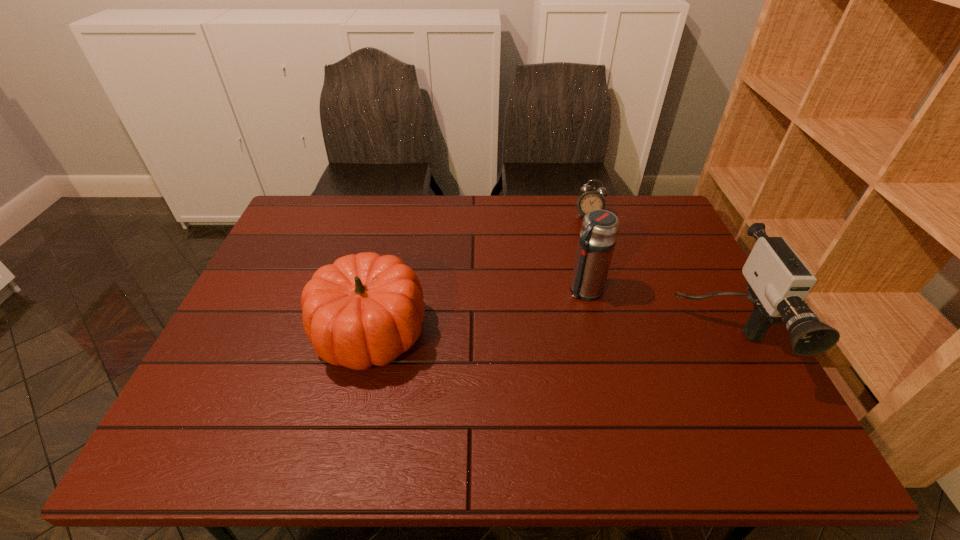
At what (x,y) coordinates should I click in order to perform the action: click on vacant space at the near edge of the desktop. Please return your answer as a coordinate pair (x, y). This screenshot has width=960, height=540. Looking at the image, I should click on (671, 403).

In the image, there is a desktop. Where is `free space at the left edge`? free space at the left edge is located at coordinates (227, 362).

The height and width of the screenshot is (540, 960). In the image, there is a desktop. In order to click on vacant space at the right edge in this screenshot , I will do `click(695, 283)`.

Locate an element on the screen. This screenshot has width=960, height=540. free space at the far left corner is located at coordinates (310, 235).

Identify the location of free space at the far right corner of the desktop. (655, 231).

Identify the location of unoccupied area between the alarm clock and the camcorder. (656, 276).

Identify the location of empty space that is in between the rightmost object and the shortest object. (656, 276).

What are the coordinates of `empty location between the rightmost object and the alarm clock` in the screenshot? It's located at (656, 276).

Identify the location of free space between the thermos bottle and the leftmost object. click(477, 310).

Find the location of a particular element. The height and width of the screenshot is (540, 960). free space between the pumpkin and the rightmost object is located at coordinates (546, 334).